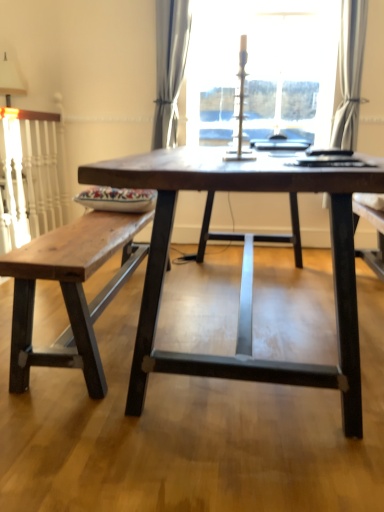
The width and height of the screenshot is (384, 512). Identify the location of free spot in front of rustic wood bench at left. (170, 428).